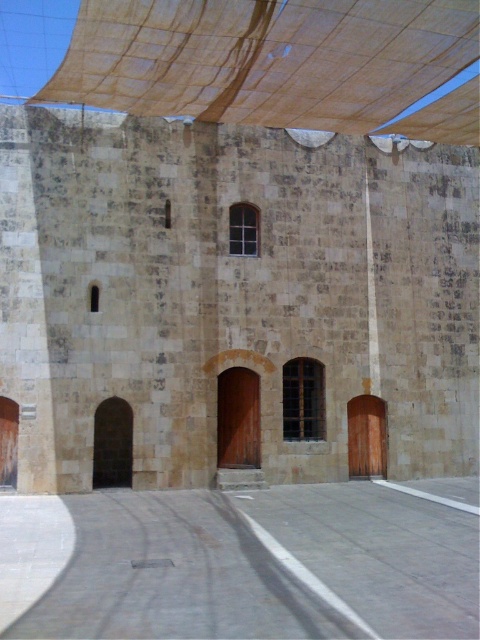
Can you confirm if brown stone building at center is wider than brown fabric canopy at upper center?

Yes, brown stone building at center is wider than brown fabric canopy at upper center.

Which of these two, brown stone building at center or brown fabric canopy at upper center, stands taller?

With more height is brown stone building at center.

This screenshot has height=640, width=480. I want to click on brown stone building at center, so click(x=231, y=305).